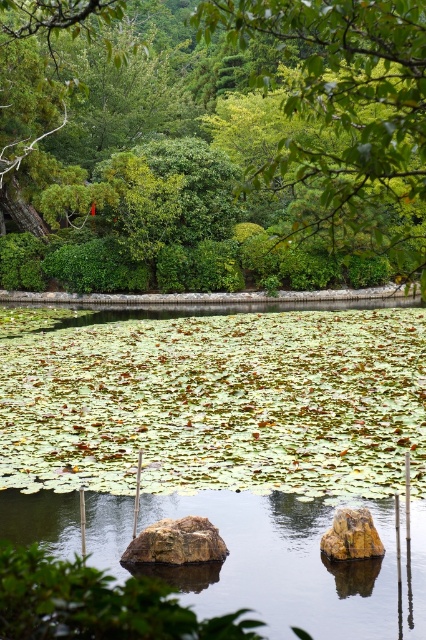
You are standing at the edge of the pond and notice two objects submerged in the water. Which one is positioned higher in the water, the brown rough rock at center or the rusty metallic boulder at center?

The brown rough rock at center is positioned higher in the water than the rusty metallic boulder at center because it is described as being above it.